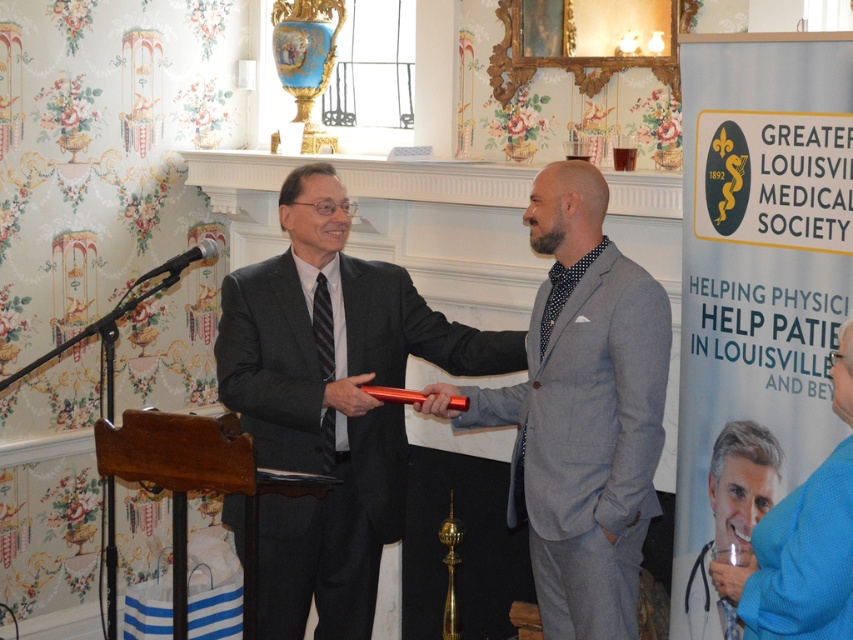
You are a photographer at the event and need to capture a closeup of both the matte black suit at center and the blue fabric shirt at lower right in a single shot. Given that your camera has a fixed focal length and a limited field of view, which subject should you position closer to the camera to ensure both fit within the frame?

Since the matte black suit at center is wider than the blue fabric shirt at lower right, you should position the matte black suit at center closer to the camera. This way, its larger size can be accommodated within the frame while still capturing the blue fabric shirt at lower right.